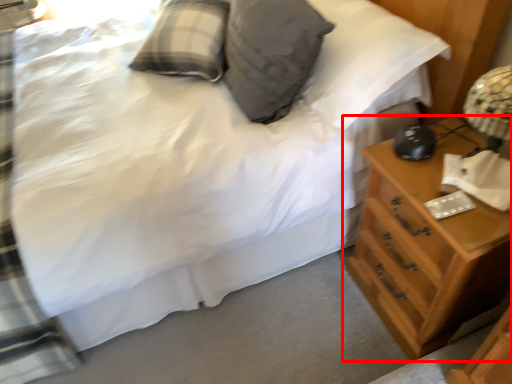
Question: From the image, what is the correct spatial relationship of chest of drawers (annotated by the red box) in relation to pillow?

Choices:
 (A) left
 (B) right

Answer: (B)